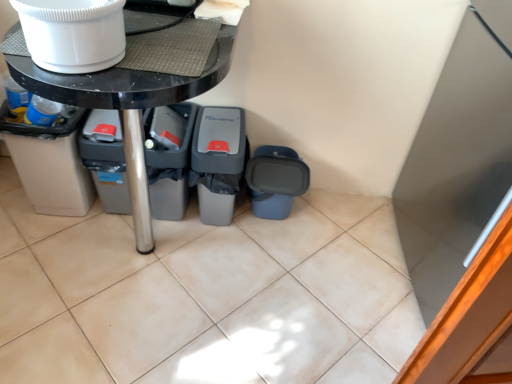
I want to click on vacant area in front of black glossy table at center, so tap(119, 342).